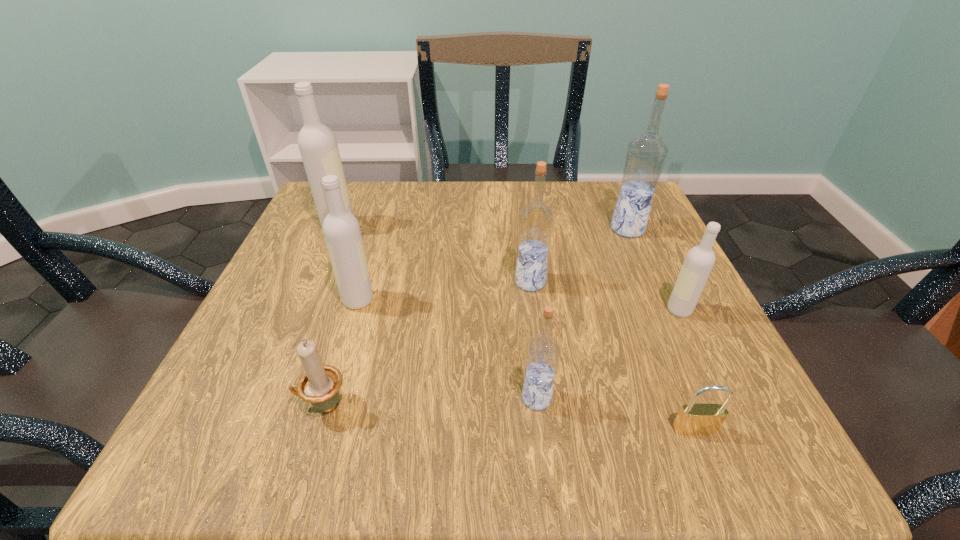
Find the location of `vodka present at the near edge`. vodka present at the near edge is located at coordinates (542, 355).

This screenshot has width=960, height=540. Find the location of `candle_holder located at the near edge`. candle_holder located at the near edge is located at coordinates (320, 384).

Locate an element on the screen. padlock present at the near edge is located at coordinates (693, 419).

Identify the location of candle_holder present at the left edge. The height and width of the screenshot is (540, 960). (320, 384).

The width and height of the screenshot is (960, 540). I want to click on padlock that is at the right edge, so click(x=693, y=419).

Where is `object that is at the far left corner`? This screenshot has height=540, width=960. object that is at the far left corner is located at coordinates (317, 143).

Image resolution: width=960 pixels, height=540 pixels. I want to click on object at the near left corner, so click(320, 384).

Where is `object located at the far right corner`? Image resolution: width=960 pixels, height=540 pixels. object located at the far right corner is located at coordinates (646, 155).

Where is `object at the near right corner`? object at the near right corner is located at coordinates (693, 419).

The image size is (960, 540). In the image, there is a desktop. What are the coordinates of `free space at the far edge` in the screenshot? It's located at (467, 182).